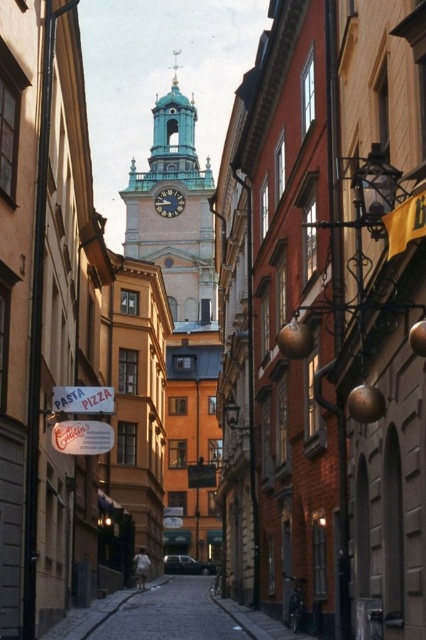
You are a tourist standing on the narrow street and want to take a photo of the green stone clock tower at center and the green patina clock at center. Which one is higher up in the image?

The green stone clock tower at center is above the green patina clock at center, so the green stone clock tower at center is higher up in the image.

Based on the photo, you are a tourist standing on the narrow street and want to take a photo of the green stone clock tower at center and the green patina clock at center. Which one will appear bigger in your photo?

The green stone clock tower at center will appear bigger in your photo because it is larger in size than the green patina clock at center.

You are a tourist standing on the narrow street and want to take a photo of both the green stone clock tower at center and the green patina clock at center. Which object should you position to your left side to include both in the frame?

You should position the green patina clock at center to your left side because the green stone clock tower at center is to the right of it, so placing the clock on your left will allow both to be captured in the photo.